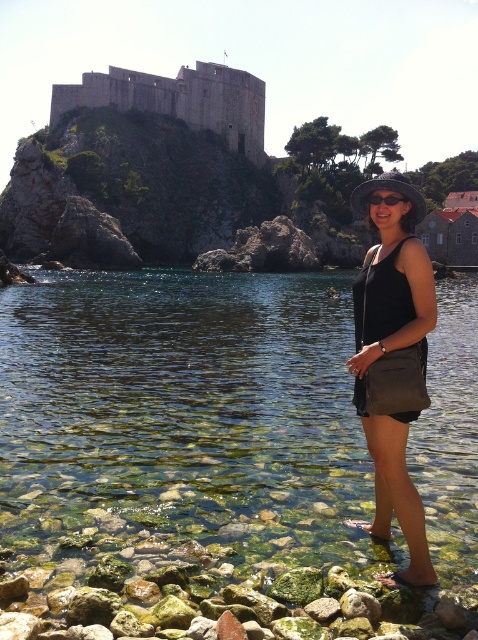
Question: Which object appears closest to the camera in this image?

Choices:
 (A) black fabric dress at lower right
 (B) brown stone castle at upper left

Answer: (A)

Question: Is the position of black fabric dress at lower right more distant than that of black plastic goggles at center?

Choices:
 (A) yes
 (B) no

Answer: (B)

Question: Can you confirm if clear glassy water at center is thinner than brown stone castle at upper left?

Choices:
 (A) no
 (B) yes

Answer: (A)

Question: Which of the following is the closest to the observer?

Choices:
 (A) (377, 198)
 (B) (139, 76)
 (C) (284, 516)
 (D) (383, 497)

Answer: (D)

Question: Does black fabric dress at lower right appear over black plastic goggles at center?

Choices:
 (A) no
 (B) yes

Answer: (A)

Question: Which point is farther to the camera?

Choices:
 (A) black fabric dress at lower right
 (B) brown stone castle at upper left

Answer: (B)